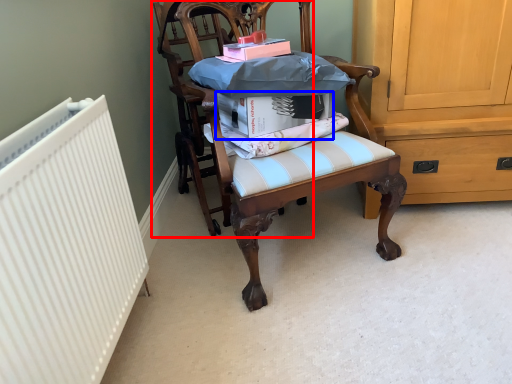
Question: Which point is closer to the camera, chair (highlighted by a red box) or book (highlighted by a blue box)?

Choices:
 (A) chair
 (B) book

Answer: (B)